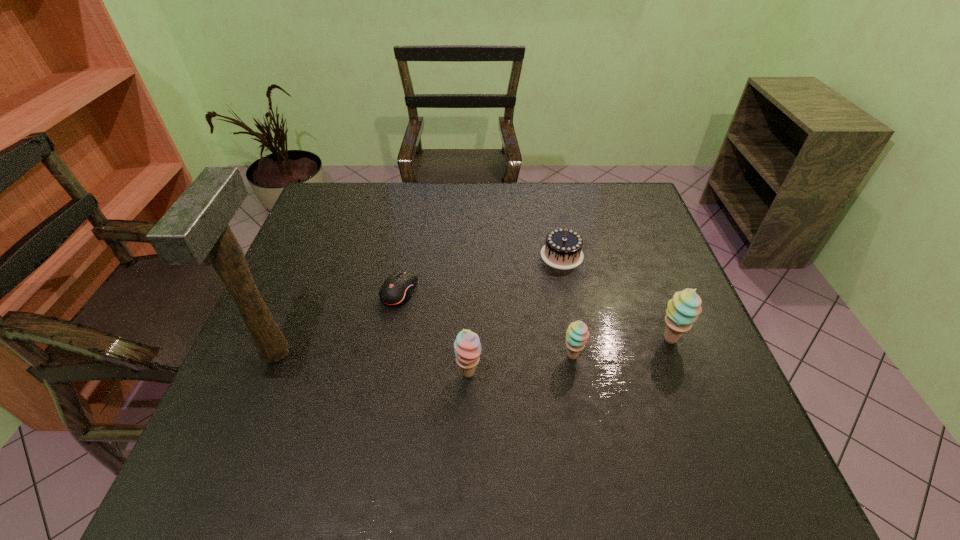
In the image, there is a desktop. Find the location of `vacant area at the near edge`. vacant area at the near edge is located at coordinates (505, 411).

The width and height of the screenshot is (960, 540). Find the location of `vacant space at the left edge of the desktop`. vacant space at the left edge of the desktop is located at coordinates (337, 231).

The height and width of the screenshot is (540, 960). I want to click on vacant space at the right edge, so click(x=615, y=259).

Locate an element on the screen. This screenshot has height=540, width=960. vacant region at the far left corner of the desktop is located at coordinates (342, 202).

At what (x,y) coordinates should I click in order to perform the action: click on free space at the near left corner of the desktop. Please return your answer as a coordinate pair (x, y). The width and height of the screenshot is (960, 540). Looking at the image, I should click on (252, 402).

Locate an element on the screen. The width and height of the screenshot is (960, 540). vacant space at the far right corner of the desktop is located at coordinates (628, 188).

The width and height of the screenshot is (960, 540). I want to click on free spot between the third tallest object and the fourth tallest object, so click(520, 365).

Locate an element on the screen. This screenshot has width=960, height=540. empty space that is in between the mallet and the second sherbert from left to right is located at coordinates (424, 354).

Locate an element on the screen. vacant space in between the rightmost object and the shortest sherbert is located at coordinates (622, 348).

At what (x,y) coordinates should I click in order to perform the action: click on free space between the leftmost sherbert and the shortest object. Please return your answer as a coordinate pair (x, y). Looking at the image, I should click on (434, 333).